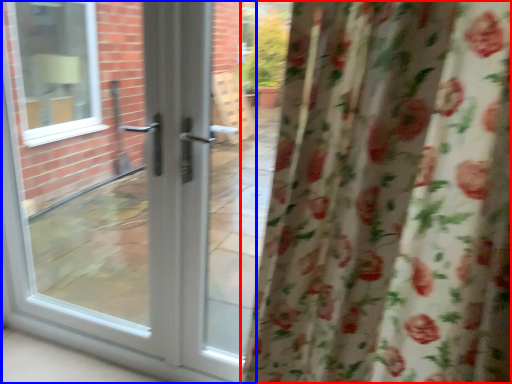
Question: Which point is further to the camera, curtain (highlighted by a red box) or door (highlighted by a blue box)?

Choices:
 (A) curtain
 (B) door

Answer: (B)